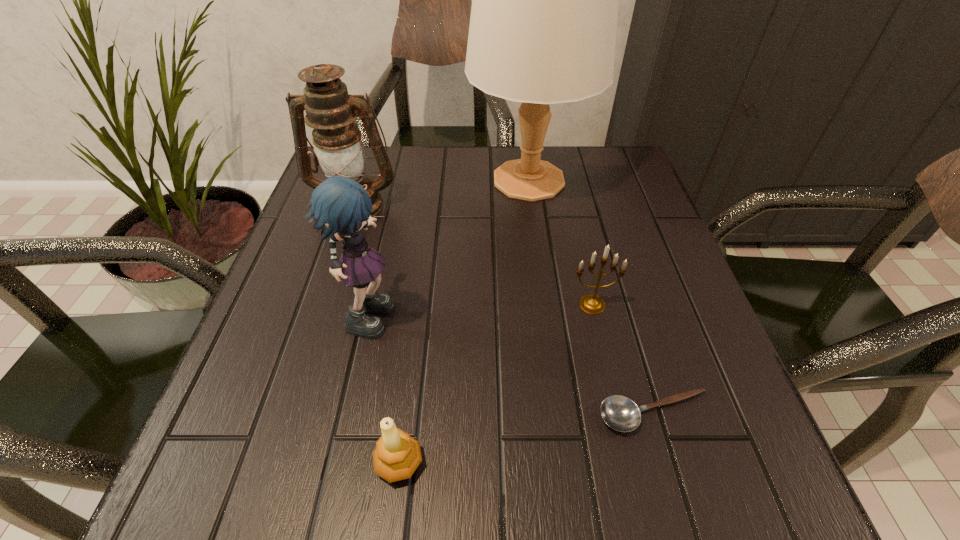
Image resolution: width=960 pixels, height=540 pixels. Identify the location of table lamp. (543, 23).

Identify the location of lantern. The width and height of the screenshot is (960, 540). (331, 112).

Where is `rag doll`? The image size is (960, 540). rag doll is located at coordinates (340, 206).

Where is `the taller candle_holder`? This screenshot has width=960, height=540. the taller candle_holder is located at coordinates (591, 303).

You are a GUI agent. You are given a task and a screenshot of the screen. Output one action in this format:
    pyautogui.click(x=<x>, y=<y>)
    Task: Click on the third shortest object
    
    Given the screenshot: What is the action you would take?
    pyautogui.click(x=591, y=303)

Where is `the fifth tallest object`? This screenshot has width=960, height=540. the fifth tallest object is located at coordinates (x=397, y=455).

The height and width of the screenshot is (540, 960). What are the coordinates of `the nearer candle_holder` in the screenshot? It's located at (397, 455).

Identify the location of ladle. This screenshot has width=960, height=540. click(x=620, y=413).

Locate an element on the screen. This screenshot has width=960, height=540. the shortest object is located at coordinates (620, 413).

Locate an element on the screen. blank space located 0.200m on the left of the table lamp is located at coordinates pos(387,180).